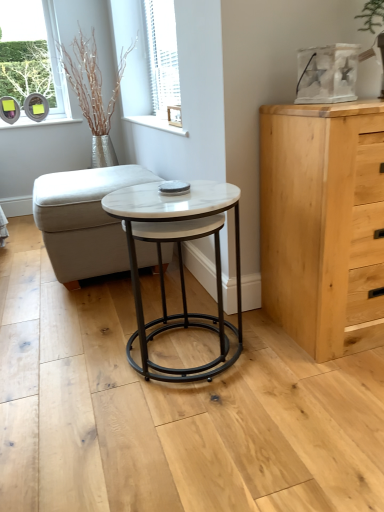
This screenshot has height=512, width=384. What do you see at coordinates (323, 223) in the screenshot?
I see `light wood chest of drawers at right` at bounding box center [323, 223].

Locate an element on the screen. This screenshot has width=384, height=512. light wood chest of drawers at right is located at coordinates (323, 223).

In order to face silver metallic vase at upper left, should I rotate leftwards or rightwards?

Turn left by 11.414 degrees to look at silver metallic vase at upper left.

Image resolution: width=384 pixels, height=512 pixels. What do you see at coordinates (93, 93) in the screenshot?
I see `silver metallic vase at upper left` at bounding box center [93, 93].

Locate an element on the screen. Image resolution: width=384 pixels, height=512 pixels. white marble coffee table at center is located at coordinates (179, 262).

Where is `white textured blinds at upper center`? white textured blinds at upper center is located at coordinates (162, 54).

What is the approximate height of white textured blinds at upper center?

30.81 inches.

The height and width of the screenshot is (512, 384). What are the coordinates of `light wood chest of drawers at right` in the screenshot? It's located at (323, 223).

Could you tell me if light wood chest of drawers at right is facing white textured blinds at upper center?

No, light wood chest of drawers at right is not turned towards white textured blinds at upper center.

Is light wood chest of drawers at right situated inside white textured blinds at upper center or outside?

light wood chest of drawers at right lies outside white textured blinds at upper center.

Considering the sizes of light wood chest of drawers at right and white textured blinds at upper center in the image, is light wood chest of drawers at right wider or thinner than white textured blinds at upper center?

Considering their sizes, light wood chest of drawers at right looks broader than white textured blinds at upper center.

Can you confirm if light wood chest of drawers at right is thinner than white fabric ottoman at center?

Yes.

What's the angular difference between light wood chest of drawers at right and white fabric ottoman at center's facing directions?

They differ by 89.5 degrees in their facing directions.

Considering the positions of objects light wood chest of drawers at right and white fabric ottoman at center in the image provided, who is more to the right, light wood chest of drawers at right or white fabric ottoman at center?

light wood chest of drawers at right.

Is silver metallic vase at upper left far from white marble coffee table at center?

Yes, silver metallic vase at upper left and white marble coffee table at center are located far from each other.

Based on the photo, is silver metallic vase at upper left oriented towards white marble coffee table at center?

No, silver metallic vase at upper left does not turn towards white marble coffee table at center.

From the image's perspective, would you say silver metallic vase at upper left is positioned over white marble coffee table at center?

→ Indeed, from the image's perspective, silver metallic vase at upper left is shown above white marble coffee table at center.

From a real-world perspective, who is located higher, silver metallic vase at upper left or white marble coffee table at center?

silver metallic vase at upper left, from a real-world perspective.

Is point (150, 64) positioned in front of point (201, 326)?

No, it is behind (201, 326).

Is white textured blinds at upper center inside or outside of white marble coffee table at center?

white textured blinds at upper center exists outside the volume of white marble coffee table at center.

Would you consider white textured blinds at upper center to be distant from white marble coffee table at center?

That's right, there is a large distance between white textured blinds at upper center and white marble coffee table at center.

From a real-world perspective, between white textured blinds at upper center and white marble coffee table at center, who is vertically lower?

white marble coffee table at center, from a real-world perspective.

Considering the sizes of objects light wood chest of drawers at right and white marble coffee table at center in the image provided, who is wider, light wood chest of drawers at right or white marble coffee table at center?

white marble coffee table at center is wider.

From a real-world perspective, which is physically below, light wood chest of drawers at right or white marble coffee table at center?

white marble coffee table at center, from a real-world perspective.

Is light wood chest of drawers at right completely or partially outside of white marble coffee table at center?

Absolutely, light wood chest of drawers at right is external to white marble coffee table at center.

Would you consider light wood chest of drawers at right to be distant from white marble coffee table at center?

No, light wood chest of drawers at right is in close proximity to white marble coffee table at center.

Is silver metallic vase at upper left a part of white marble coffee table at center?

No, silver metallic vase at upper left is not a part of white marble coffee table at center.

What's the angular difference between white marble coffee table at center and silver metallic vase at upper left's facing directions?

5.49 degrees.

Consider the image. Is white marble coffee table at center facing towards silver metallic vase at upper left?

No.

Which is in front, white marble coffee table at center or silver metallic vase at upper left?

white marble coffee table at center is closer to the camera.

From the image's perspective, is white fabric ottoman at center positioned above or below white textured blinds at upper center?

white fabric ottoman at center is below white textured blinds at upper center.

Is white fabric ottoman at center thinner than white textured blinds at upper center?

No.

Choose the correct answer: Is white fabric ottoman at center inside white textured blinds at upper center or outside it?

white fabric ottoman at center lies outside white textured blinds at upper center.

Considering the sizes of objects white fabric ottoman at center and white textured blinds at upper center in the image provided, who is taller, white fabric ottoman at center or white textured blinds at upper center?

white textured blinds at upper center is taller.

Locate an element on the screen. the chest of drawers below the white textured blinds at upper center (from the image's perspective) is located at coordinates (x=323, y=223).

Where is `swivel chair behind the light wood chest of drawers at right`? The width and height of the screenshot is (384, 512). swivel chair behind the light wood chest of drawers at right is located at coordinates (84, 220).

When comparing their distances from light wood chest of drawers at right, does white fabric ottoman at center or white marble coffee table at center seem closer?

white marble coffee table at center lies closer to light wood chest of drawers at right than the other object.

Considering their positions, is silver metallic vase at upper left positioned further to light wood chest of drawers at right than white marble coffee table at center?

silver metallic vase at upper left lies further to light wood chest of drawers at right than the other object.

Which object lies further to the anchor point white fabric ottoman at center, white marble coffee table at center or silver metallic vase at upper left?

silver metallic vase at upper left is positioned further to the anchor white fabric ottoman at center.

Considering their positions, is white textured blinds at upper center positioned further to white marble coffee table at center than light wood chest of drawers at right?

The object further to white marble coffee table at center is white textured blinds at upper center.

Estimate the real-world distances between objects in this image. Which object is closer to white fabric ottoman at center, silver metallic vase at upper left or white marble coffee table at center?

white marble coffee table at center is positioned closer to the anchor white fabric ottoman at center.

Based on their spatial positions, is white fabric ottoman at center or white textured blinds at upper center further from light wood chest of drawers at right?

white textured blinds at upper center is further to light wood chest of drawers at right.

Looking at the image, which one is located closer to silver metallic vase at upper left, white fabric ottoman at center or white textured blinds at upper center?

Among the two, white textured blinds at upper center is located nearer to silver metallic vase at upper left.

When comparing their distances from white textured blinds at upper center, does light wood chest of drawers at right or white fabric ottoman at center seem closer?

Among the two, white fabric ottoman at center is located nearer to white textured blinds at upper center.

At what (x,y) coordinates should I click in order to perform the action: click on swivel chair between white textured blinds at upper center and light wood chest of drawers at right vertically. Please return your answer as a coordinate pair (x, y). This screenshot has width=384, height=512. Looking at the image, I should click on (84, 220).

Where is `window positioned between light wood chest of drawers at right and silver metallic vase at upper left from near to far`? Image resolution: width=384 pixels, height=512 pixels. window positioned between light wood chest of drawers at right and silver metallic vase at upper left from near to far is located at coordinates (162, 54).

Image resolution: width=384 pixels, height=512 pixels. Identify the location of coffee table between white fabric ottoman at center and light wood chest of drawers at right. (179, 262).

Locate an element on the screen. The image size is (384, 512). window between white marble coffee table at center and silver metallic vase at upper left along the z-axis is located at coordinates (162, 54).